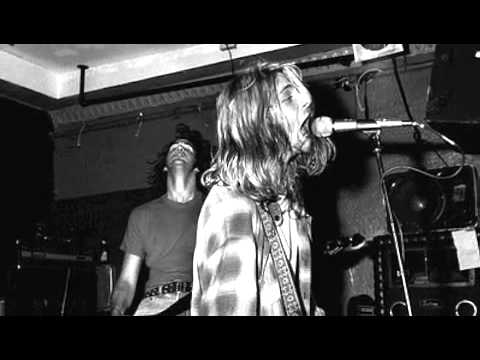
I want to click on speaker, so 440,202.